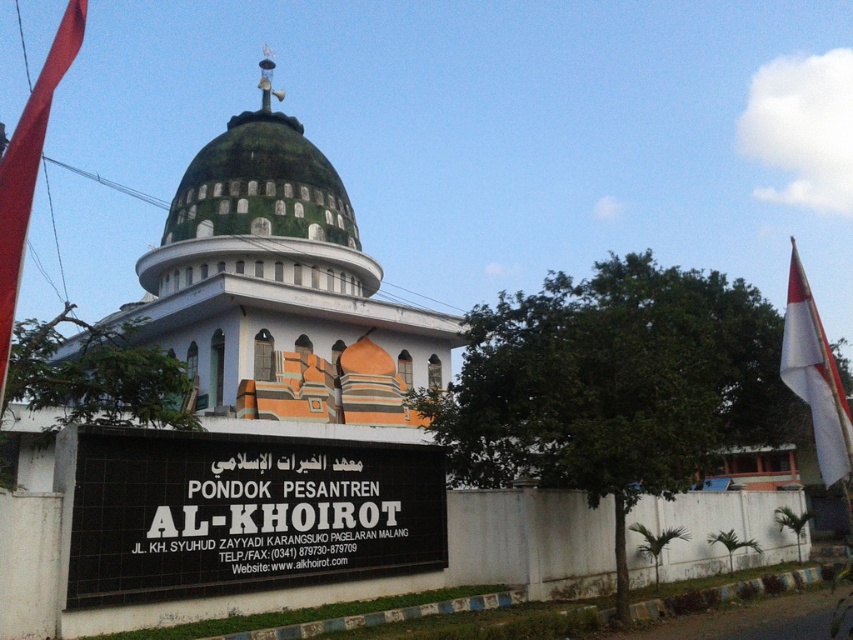
Is point (289, 150) closer to camera compared to point (9, 346)?

No, (289, 150) is further to viewer.

From the picture: Who is lower down, green matte dome at center or red fabric flag at left?

Positioned lower is green matte dome at center.

Between point (344, 220) and point (26, 180), which one is positioned in front?

Positioned in front is point (26, 180).

This screenshot has width=853, height=640. Find the location of `green matte dome at center`. green matte dome at center is located at coordinates (259, 209).

Who is positioned more to the left, black plastic sign at center or white fabric flag at right?

black plastic sign at center is more to the left.

Is point (132, 600) farther from camera compared to point (820, 364)?

No, (132, 600) is in front of (820, 364).

Is point (148, 566) positioned in front of point (790, 273)?

Yes, it is.

This screenshot has width=853, height=640. I want to click on black plastic sign at center, so click(245, 513).

Does green matte dome at center have a lesser width compared to white fabric flag at right?

Correct, green matte dome at center's width is less than white fabric flag at right's.

Measure the distance between green matte dome at center and white fabric flag at right.

green matte dome at center is 49.46 meters from white fabric flag at right.

Consider the image. Who is more distant from viewer, (258, 188) or (817, 432)?

Positioned behind is point (258, 188).

Identify the location of green matte dome at center. This screenshot has width=853, height=640. (259, 209).